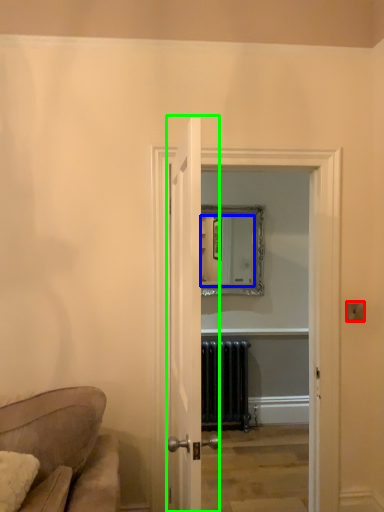
Question: Which object is positioned farthest from light switch (highlighted by a red box)? Select from mirror (highlighted by a blue box) and door (highlighted by a green box).

Choices:
 (A) mirror
 (B) door

Answer: (A)